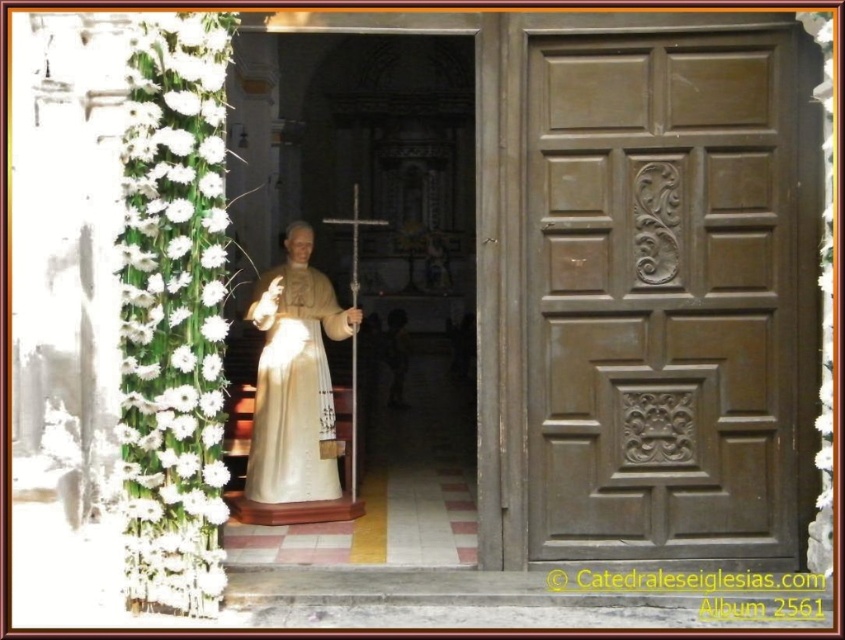
Is point (538, 452) behind point (279, 266)?

No, it is not.

Is point (565, 269) farther from camera compared to point (260, 369)?

No.

Find the location of a particular element. brown carved wood door at right is located at coordinates (671, 292).

Which of these two, brown carved wood door at right or metallic silver crucifix at center, stands shorter?

metallic silver crucifix at center

Is brown carved wood door at right bigger than metallic silver crucifix at center?

Incorrect, brown carved wood door at right is not larger than metallic silver crucifix at center.

Which is behind, point (646, 339) or point (350, 362)?

Positioned behind is point (350, 362).

This screenshot has width=845, height=640. What are the coordinates of `brown carved wood door at right` in the screenshot? It's located at (671, 292).

Does matte gold robe at center have a lesser width compared to metallic silver crucifix at center?

Correct, matte gold robe at center's width is less than metallic silver crucifix at center's.

Who is taller, matte gold robe at center or metallic silver crucifix at center?

With more height is metallic silver crucifix at center.

Identify the location of matte gold robe at center. point(293,387).

At what (x,y) coordinates should I click in order to perform the action: click on matte gold robe at center. Please return your answer as a coordinate pair (x, y). This screenshot has height=640, width=845. Looking at the image, I should click on (293, 387).